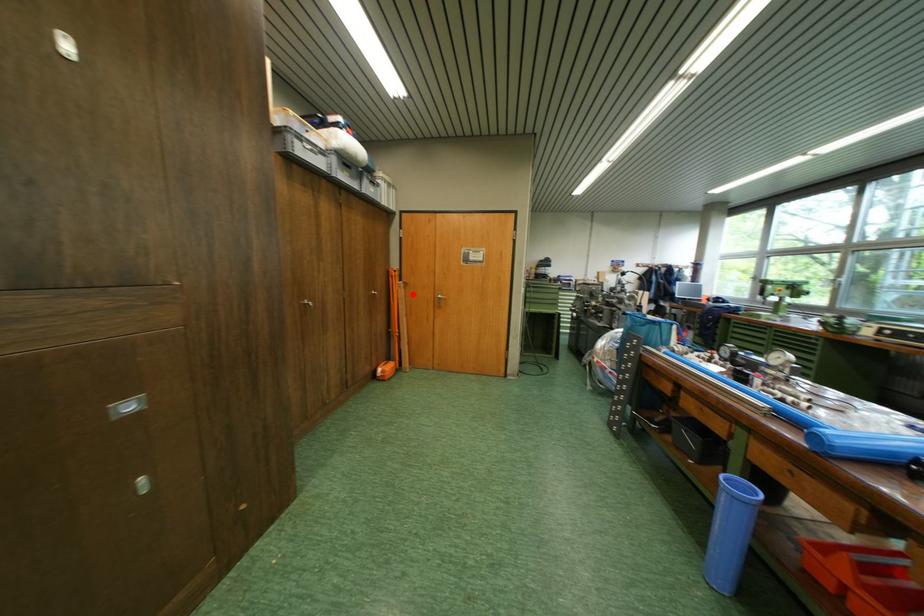
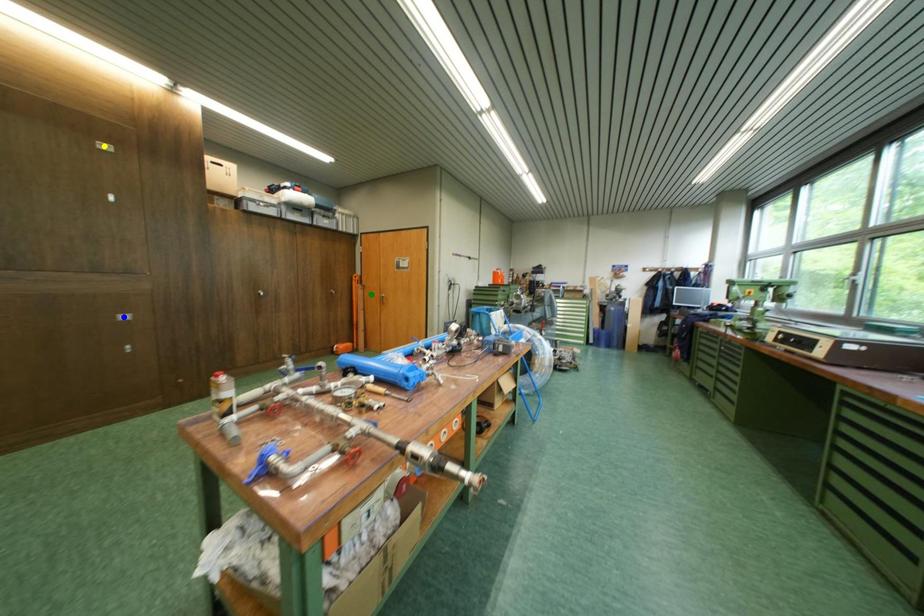
Question: I am providing you with two images of the same scene from different viewpoints. A red point is marked on the first image. You are given multiple points on the second image. Which mark in image 2 goes with the point in image 1?

Choices:
 (A) blue point
 (B) green point
 (C) yellow point

Answer: (B)